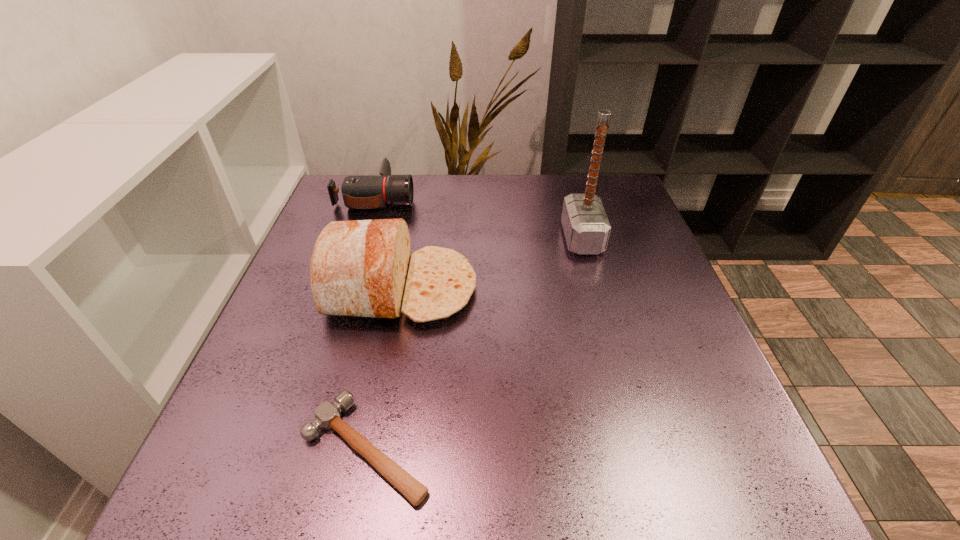
At what (x,y) coordinates should I click in order to perform the action: click on the rightmost object. Please return your answer as a coordinate pair (x, y). Looking at the image, I should click on [586, 227].

Identify the location of the taller hammer. This screenshot has height=540, width=960. (586, 227).

You are a GUI agent. You are given a task and a screenshot of the screen. Output one action in this format:
    pyautogui.click(x=<x>, y=<y>)
    Task: Click on the second tallest object
    The height and width of the screenshot is (540, 960).
    Given the screenshot: What is the action you would take?
    pyautogui.click(x=362, y=268)

I want to click on the second shortest object, so click(359, 192).

This screenshot has width=960, height=540. In order to click on camcorder in this screenshot , I will do `click(359, 192)`.

I want to click on the shorter hammer, so click(327, 415).

This screenshot has width=960, height=540. Identify the location of the nearer hammer. (327, 415).

I want to click on vacant region located on the striking surface of the farther hammer, so click(471, 239).

Where is `free region located on the striking surface of the farther hammer`? free region located on the striking surface of the farther hammer is located at coordinates (499, 239).

Locate an element on the screen. This screenshot has height=540, width=960. vacant space located 0.070m on the striking surface of the farther hammer is located at coordinates (536, 239).